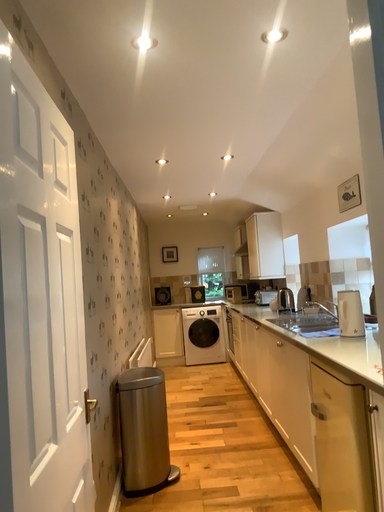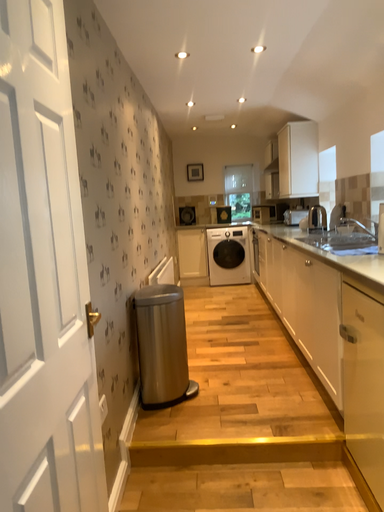
Question: How did the camera likely rotate when shooting the video?

Choices:
 (A) rotated upward
 (B) rotated downward

Answer: (B)